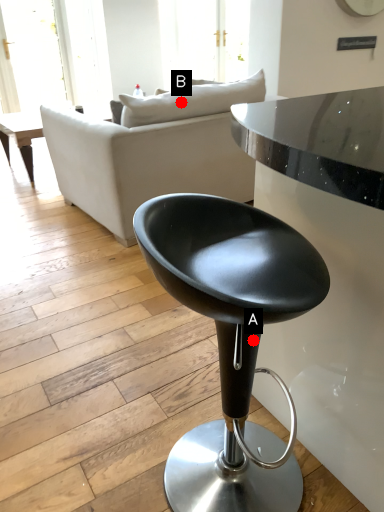
Question: Two points are circled on the image, labeled by A and B beside each circle. Which of the following is the closest to the observer?

Choices:
 (A) A is closer
 (B) B is closer

Answer: (A)